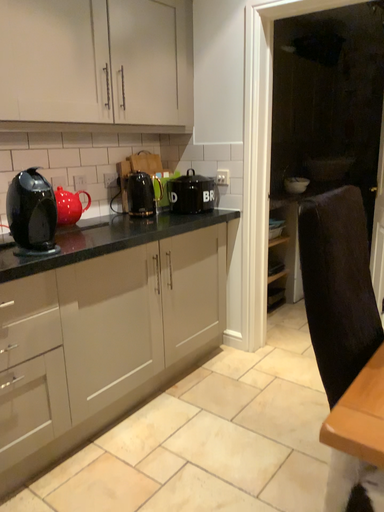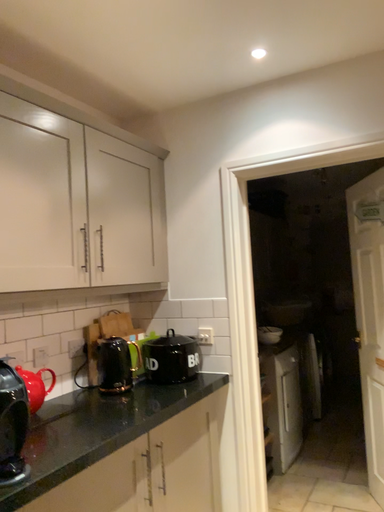
Question: How did the camera likely rotate when shooting the video?

Choices:
 (A) rotated upward
 (B) rotated downward

Answer: (A)